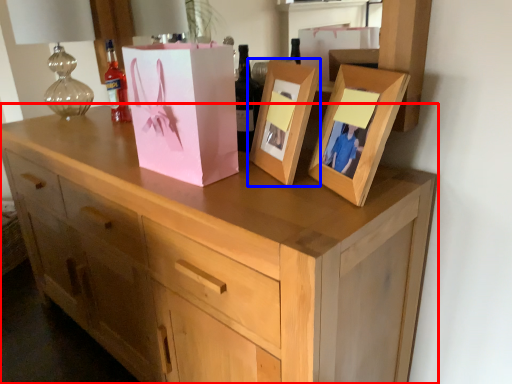
Question: Among these objects, which one is farthest to the camera, chest of drawers (highlighted by a red box) or picture frame (highlighted by a blue box)?

Choices:
 (A) chest of drawers
 (B) picture frame

Answer: (B)